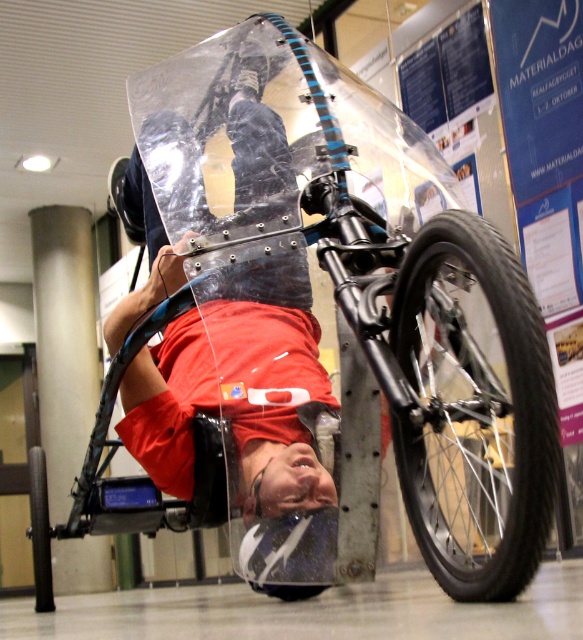
Can you confirm if transparent plastic bicycle at center is wider than black rubber tire at lower center?

Yes, transparent plastic bicycle at center is wider than black rubber tire at lower center.

This screenshot has width=583, height=640. In order to click on transparent plastic bicycle at center in this screenshot , I will do `click(340, 326)`.

Who is taller, black rubber tire at lower right or black rubber tire at lower center?

black rubber tire at lower right is taller.

Can you confirm if black rubber tire at lower right is positioned below black rubber tire at lower center?

No, black rubber tire at lower right is not below black rubber tire at lower center.

Is point (550, 412) closer to viewer compared to point (43, 563)?

Yes, point (550, 412) is closer to viewer.

I want to click on black rubber tire at lower right, so click(x=473, y=410).

Looking at this image, between transparent plastic bicycle at center and black rubber tire at lower right, which one appears on the right side from the viewer's perspective?

Positioned to the right is black rubber tire at lower right.

Which is above, transparent plastic bicycle at center or black rubber tire at lower right?

Positioned higher is transparent plastic bicycle at center.

Does point (517, 435) come in front of point (472, 557)?

Yes, point (517, 435) is closer to viewer.

Where is `transparent plastic bicycle at center`? Image resolution: width=583 pixels, height=640 pixels. transparent plastic bicycle at center is located at coordinates (340, 326).